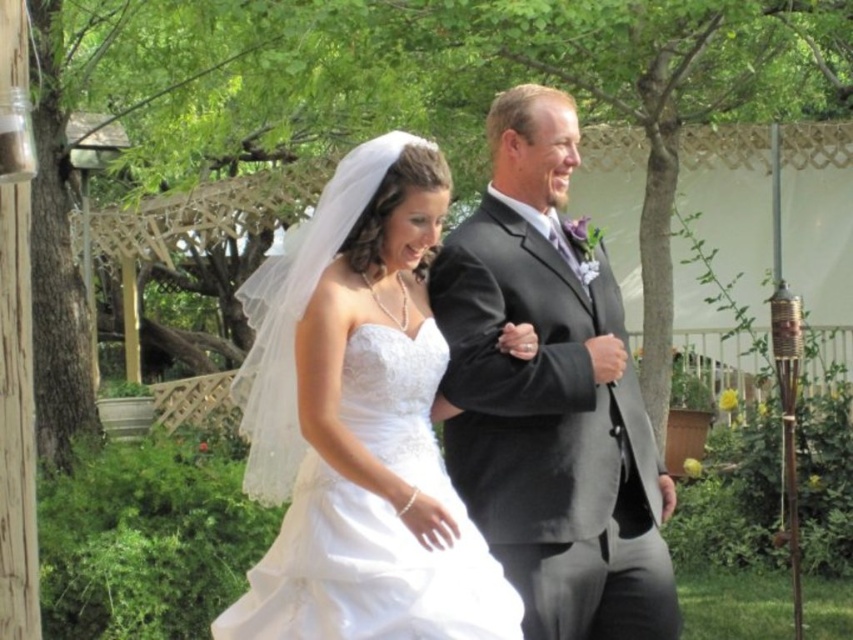
You are a photographer standing at point (271,499). The bride and groom are walking towards the garden archway. To capture their interaction, you need to position yourself so that you can see both of them clearly. Based on their current distance apart, is the distance between them sufficient for a group photo where they are framed together without overlapping?

The distance between the bride and groom is 4.29 meters. For a group photo where they are framed together without overlapping, this distance may be too far, as typical group photos require subjects to be closer. However, depending on the camera lens and framing, it might still be possible but would require careful composition.

You are a photographer at a wedding. You need to capture a photo of the white satin dress at center and the matte black suit at center. Based on their positions, which one is lower in the image?

The white satin dress at center is positioned under the matte black suit at center, so it is lower in the image.

You are a photographer at the wedding and want to capture a closeup shot of the bride and groom. Since the white satin dress at center is larger than the matte black suit at center, will you need to adjust your camera angle to ensure both are fully in frame?

Yes, the white satin dress at center is larger in size than the matte black suit at center, so adjusting the camera angle may be necessary to ensure both are fully visible in the frame.